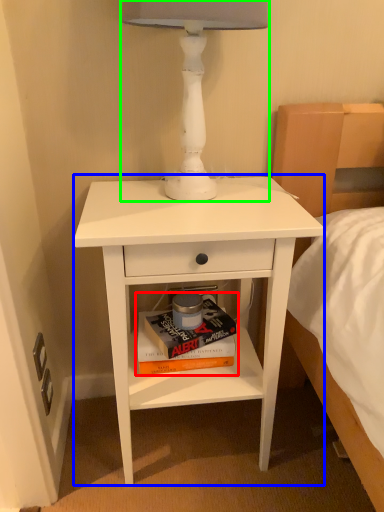
Question: Which object is the farthest from paperback book (highlighted by a red box)? Choose among these: nightstand (highlighted by a blue box) or table lamp (highlighted by a green box).

Choices:
 (A) nightstand
 (B) table lamp

Answer: (B)